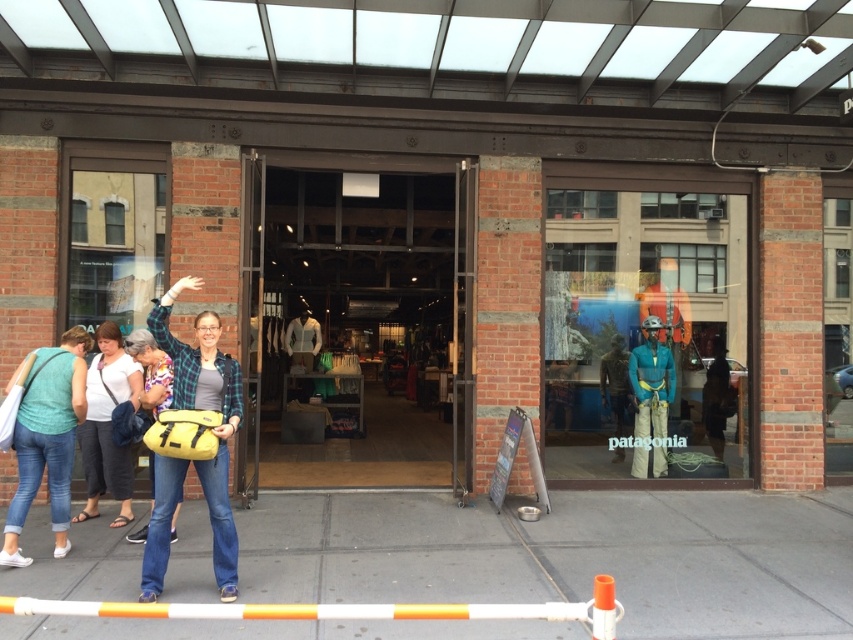
Image resolution: width=853 pixels, height=640 pixels. What do you see at coordinates (569, 556) in the screenshot?
I see `gray concrete pavement at lower center` at bounding box center [569, 556].

Who is more distant from viewer, [500,529] or [48,449]?

The point [500,529] is behind.

At what (x,y) coordinates should I click in order to perform the action: click on gray concrete pavement at lower center. Please return your answer as a coordinate pair (x, y). This screenshot has height=640, width=853. Looking at the image, I should click on (569, 556).

Who is more distant from viewer, (265, 496) or (97, 387)?

Point (265, 496)

This screenshot has height=640, width=853. What do you see at coordinates (569, 556) in the screenshot?
I see `gray concrete pavement at lower center` at bounding box center [569, 556].

Who is more distant from viewer, (x=50, y=572) or (x=91, y=467)?

The point (x=91, y=467) is behind.

Locate an element on the screen. gray concrete pavement at lower center is located at coordinates (569, 556).

Is blue fabric mannequin at center below matte teal t-shirt at lower left?

Actually, blue fabric mannequin at center is above matte teal t-shirt at lower left.

Is blue fabric mannequin at center in front of matte teal t-shirt at lower left?

No.

Is point (677, 408) closer to camera compared to point (36, 488)?

No.

Find the location of a particular element. This screenshot has width=853, height=640. blue fabric mannequin at center is located at coordinates (x=645, y=328).